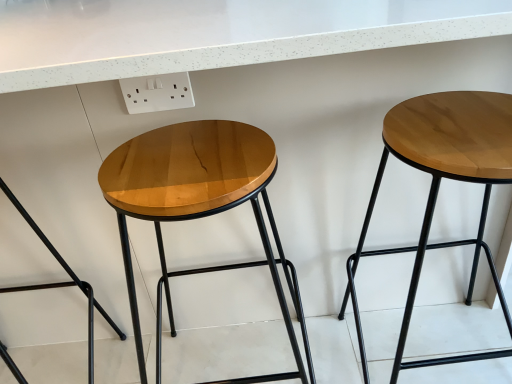
The height and width of the screenshot is (384, 512). Identify the location of free space above wooden stool at center, which is the second stool from right to left (from a real-world perspective). (190, 160).